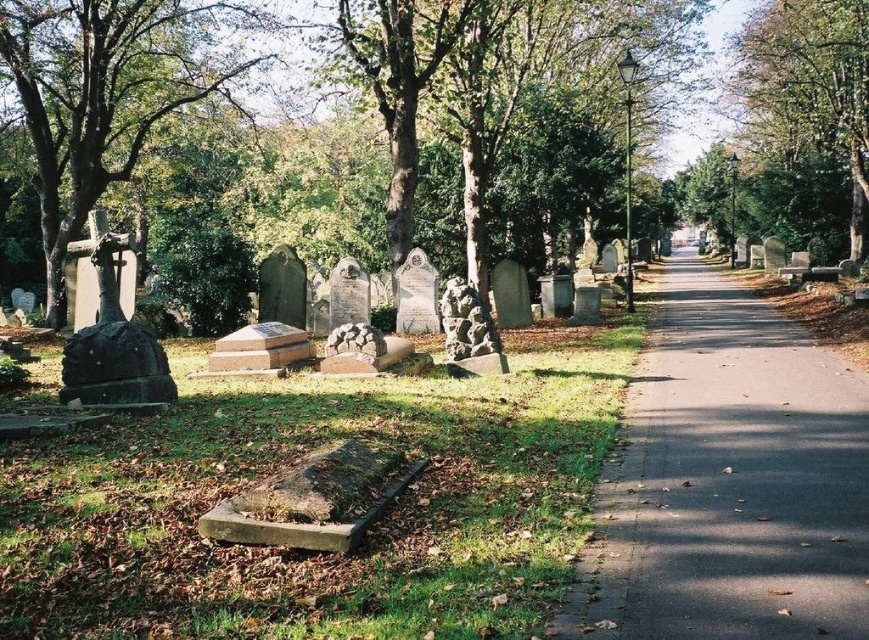
You are standing at the entrance of the cemetery and see the green leafy tree at left and the green leafy tree at upper center. Which tree is closer to the entrance?

The green leafy tree at left is closer to the entrance because it is located below the green leafy tree at upper center, indicating it is positioned lower in the image and thus nearer to the viewer standing at the entrance.

You are standing on the cemetery pathway and see the green leafy tree at left and the green leafy tree at upper center. Which tree is taller?

The green leafy tree at upper center is taller than the green leafy tree at left.

In the scene shown: You are standing at the center of the cemetery pathway. You see a point marked at coordinates (110,90). What object does this point correspond to?

The point at coordinates (110,90) corresponds to the green leafy tree at left.